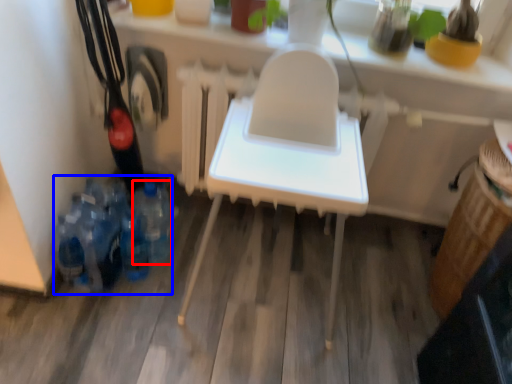
Question: Among these objects, which one is nearest to the camera, bottle (highlighted by a red box) or bottle (highlighted by a blue box)?

Choices:
 (A) bottle
 (B) bottle

Answer: (B)